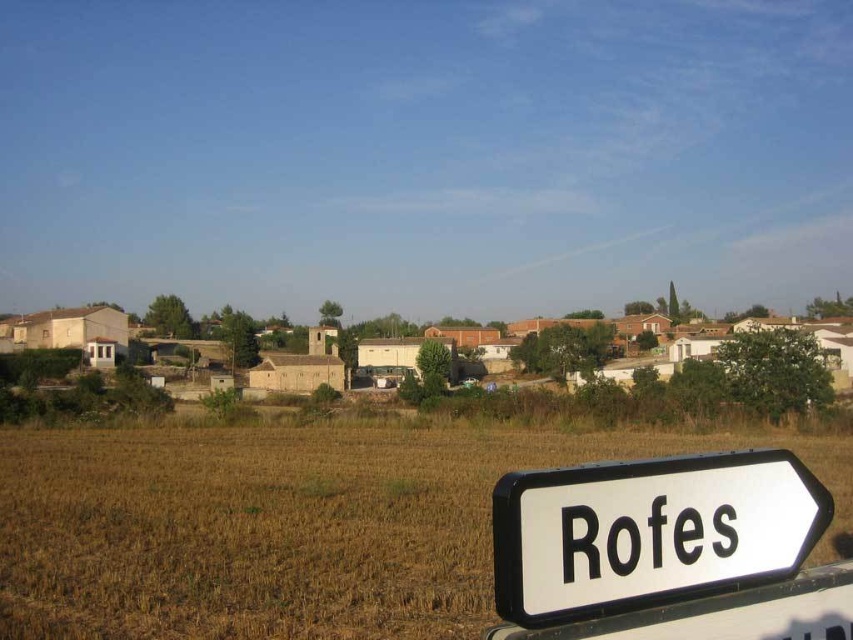
From the picture: You are standing at the bottom right corner of the image where the road sign is. Looking towards the village of Rofes, can you see the brown grassland at lower left from your current position?

The brown grassland at lower left is located at point (289, 525), which is in the lower left area of the image. Since you are at the bottom right corner near the road sign, the brown grassland at lower left would be behind you or to your left, so you cannot see it while facing the village of Rofes.

You are a hiker who wants to reach the village of Rofes. You see the brown grassland at lower left and the white plastic sign at lower right. According to the sign, which direction should you head towards to reach the village?

The white plastic sign at lower right points towards the village of Rofes. Since the brown grassland at lower left is on the right side of the sign, you should head in the direction the sign indicates, which is towards the grassland area to reach Rofes.

You are a hiker who wants to know which area is wider between the brown grassland at lower left and the white plastic sign at lower right. Which one is wider?

The brown grassland at lower left is wider than the white plastic sign at lower right.